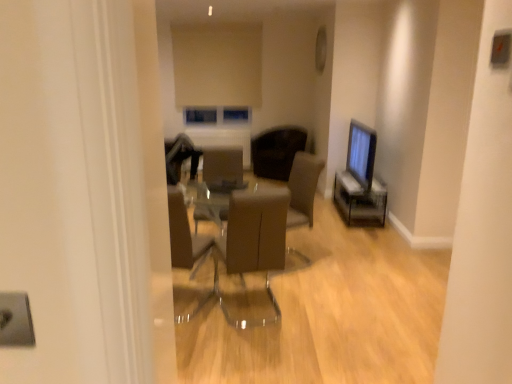
Question: Considering the relative sizes of brown leather chair at center, which is counted as the second chair, starting from the top, and brown leather chair at center, arranged as the second chair when viewed from the front, in the image provided, is brown leather chair at center, which is counted as the second chair, starting from the top, smaller than brown leather chair at center, arranged as the second chair when viewed from the front,?

Choices:
 (A) yes
 (B) no

Answer: (A)

Question: Does brown leather chair at center, which is counted as the second chair, starting from the top, have a greater height compared to brown leather chair at center, arranged as the second chair when viewed from the front?

Choices:
 (A) yes
 (B) no

Answer: (A)

Question: Considering the relative positions of brown leather chair at center, which is counted as the second chair, starting from the top, and brown leather chair at center, the 1th chair positioned from the back, in the image provided, is brown leather chair at center, which is counted as the second chair, starting from the top, behind brown leather chair at center, the 1th chair positioned from the back,?

Choices:
 (A) no
 (B) yes

Answer: (A)

Question: Is there a large distance between brown leather chair at center, acting as the 1th chair starting from the front, and brown leather chair at center, arranged as the second chair when viewed from the front?

Choices:
 (A) no
 (B) yes

Answer: (B)

Question: From a real-world perspective, is brown leather chair at center, the 1th chair positioned from the bottom, on brown leather chair at center, arranged as the second chair when viewed from the front?

Choices:
 (A) yes
 (B) no

Answer: (B)

Question: Are brown leather chair at center, which is counted as the second chair, starting from the top, and brown leather chair at center, the 1th chair positioned from the back, making contact?

Choices:
 (A) no
 (B) yes

Answer: (A)

Question: Can you confirm if brown leather chair at center, acting as the 1th chair starting from the front, is positioned to the right of matte brown armchair at center?

Choices:
 (A) no
 (B) yes

Answer: (B)

Question: Considering the relative sizes of brown leather chair at center, acting as the 1th chair starting from the front, and matte brown armchair at center in the image provided, is brown leather chair at center, acting as the 1th chair starting from the front, wider than matte brown armchair at center?

Choices:
 (A) yes
 (B) no

Answer: (A)

Question: Is brown leather chair at center, acting as the 1th chair starting from the front, positioned before matte brown armchair at center?

Choices:
 (A) yes
 (B) no

Answer: (A)

Question: From a real-world perspective, does brown leather chair at center, acting as the 1th chair starting from the front, stand above matte brown armchair at center?

Choices:
 (A) no
 (B) yes

Answer: (A)

Question: Does brown leather chair at center, acting as the 1th chair starting from the front, have a larger size compared to matte brown armchair at center?

Choices:
 (A) no
 (B) yes

Answer: (B)

Question: Considering the relative sizes of brown leather chair at center, which is counted as the second chair, starting from the top, and matte brown armchair at center in the image provided, is brown leather chair at center, which is counted as the second chair, starting from the top, smaller than matte brown armchair at center?

Choices:
 (A) no
 (B) yes

Answer: (A)

Question: Considering the relative sizes of matte brown armchair at center and brown leather chair at center, the second chair viewed from the back, in the image provided, is matte brown armchair at center wider than brown leather chair at center, the second chair viewed from the back,?

Choices:
 (A) no
 (B) yes

Answer: (A)